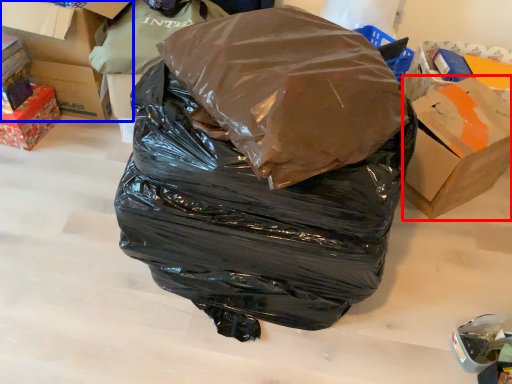
Question: Among these objects, which one is nearest to the camera, cardboard box (highlighted by a red box) or box (highlighted by a blue box)?

Choices:
 (A) cardboard box
 (B) box

Answer: (A)